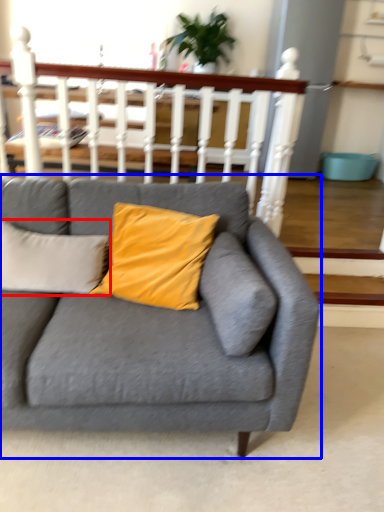
Question: Which point is closer to the camera, pillow (highlighted by a red box) or studio couch (highlighted by a blue box)?

Choices:
 (A) pillow
 (B) studio couch

Answer: (B)